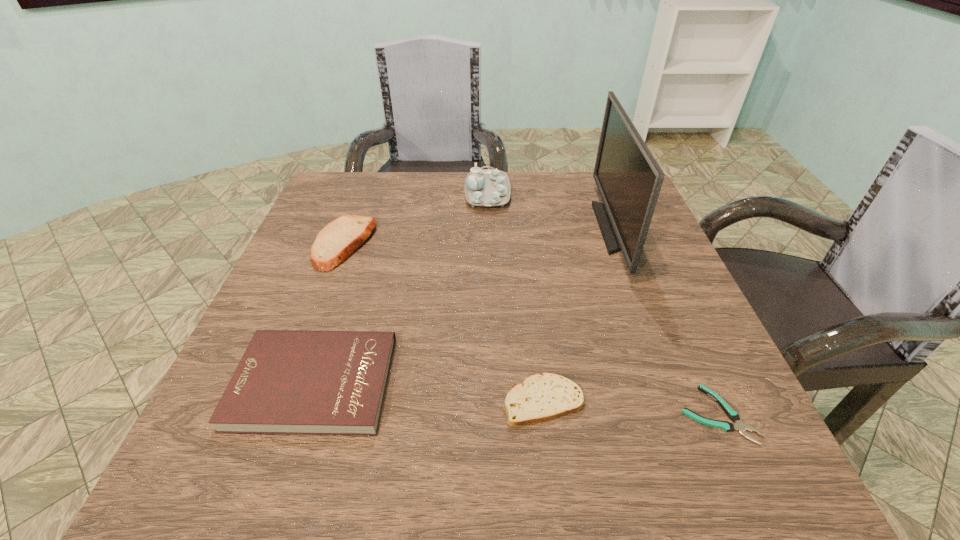
Where is `vacant space positioned on the screen side of the tallest object`? vacant space positioned on the screen side of the tallest object is located at coordinates (513, 228).

Find the location of a particular element. The image size is (960, 540). free point located on the front of the second tallest object is located at coordinates (491, 306).

Find the location of a particular element. Image resolution: width=960 pixels, height=540 pixels. vacant region located on the right of the farther pita bread is located at coordinates (434, 244).

Locate an element on the screen. vacant area located on the back of the hardback book is located at coordinates (358, 251).

In order to click on vacant area located 0.080m on the front of the fifth tallest object in this screenshot , I will do [553, 481].

Where is `vacant space located 0.370m on the back of the pliers`? vacant space located 0.370m on the back of the pliers is located at coordinates (643, 248).

Find the location of a particular element. Image resolution: width=960 pixels, height=540 pixels. monitor that is at the far edge is located at coordinates (629, 179).

I want to click on chinaware located at the far edge, so click(487, 188).

Locate an element on the screen. This screenshot has height=540, width=960. pita bread situated at the far edge is located at coordinates (340, 238).

The width and height of the screenshot is (960, 540). What are the coordinates of `hardback book at the near edge` in the screenshot? It's located at (306, 382).